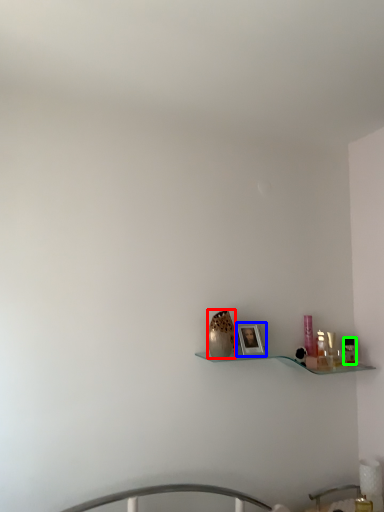
Question: Estimate the real-world distances between objects in this image. Which object is closer to vase (highlighted by a red box), picture frame (highlighted by a blue box) or toiletry (highlighted by a green box)?

Choices:
 (A) picture frame
 (B) toiletry

Answer: (A)